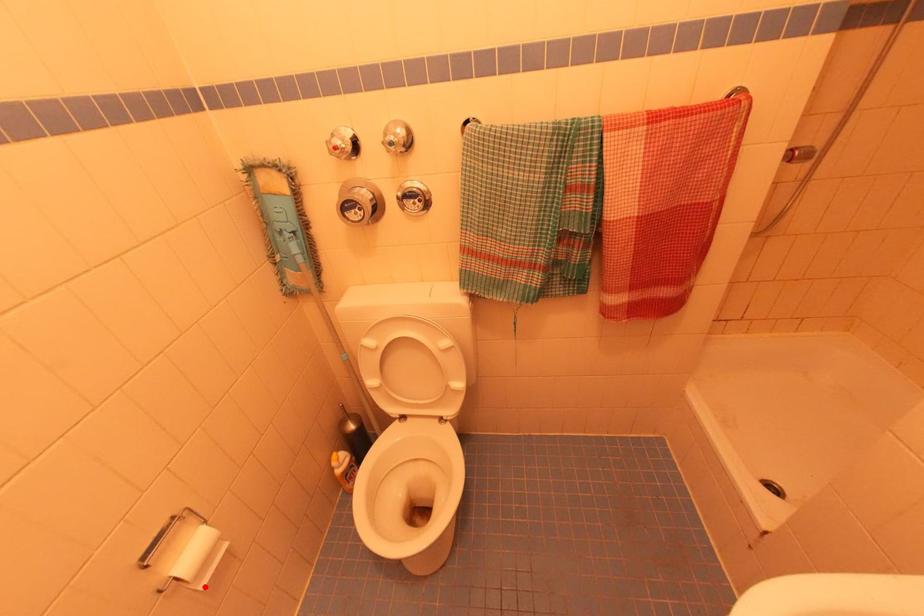
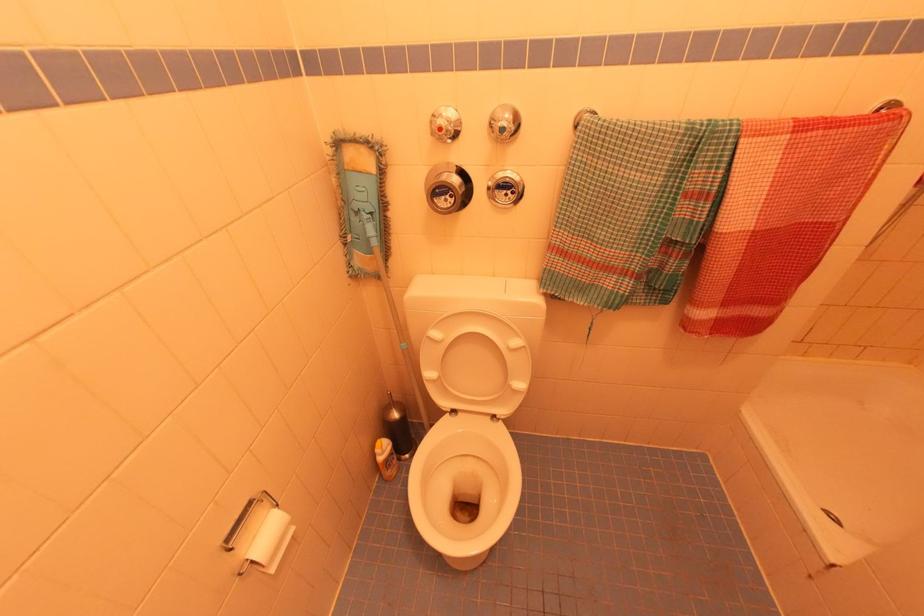
Question: I am providing you with two images of the same scene from different viewpoints. Image1 has a red point marked. In image2, the corresponding 3D location appears at what relative position? Reply with the corresponding letter.

Choices:
 (A) Closer
 (B) Farther

Answer: (A)